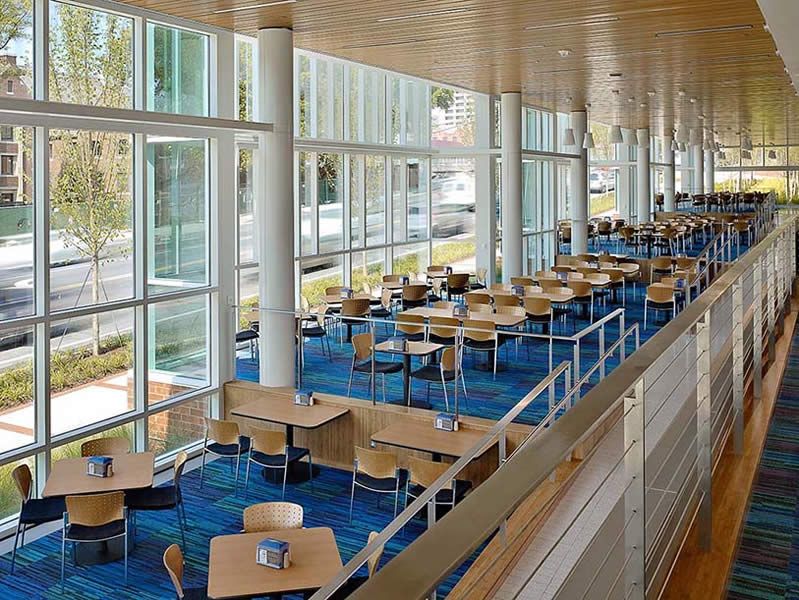
In order to click on small rectangular table in this screenshot , I will do `click(133, 472)`, `click(269, 409)`, `click(319, 548)`, `click(400, 429)`, `click(424, 347)`, `click(332, 299)`, `click(253, 319)`, `click(391, 284)`.